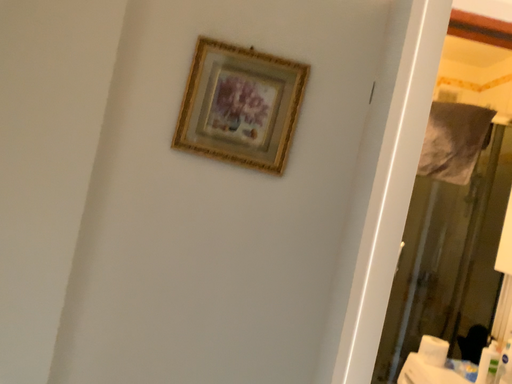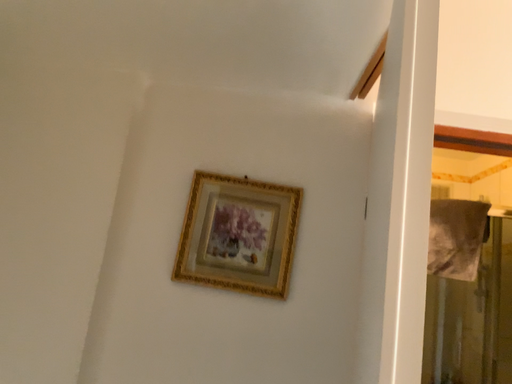
Question: How did the camera likely rotate when shooting the video?

Choices:
 (A) rotated upward
 (B) rotated downward

Answer: (A)